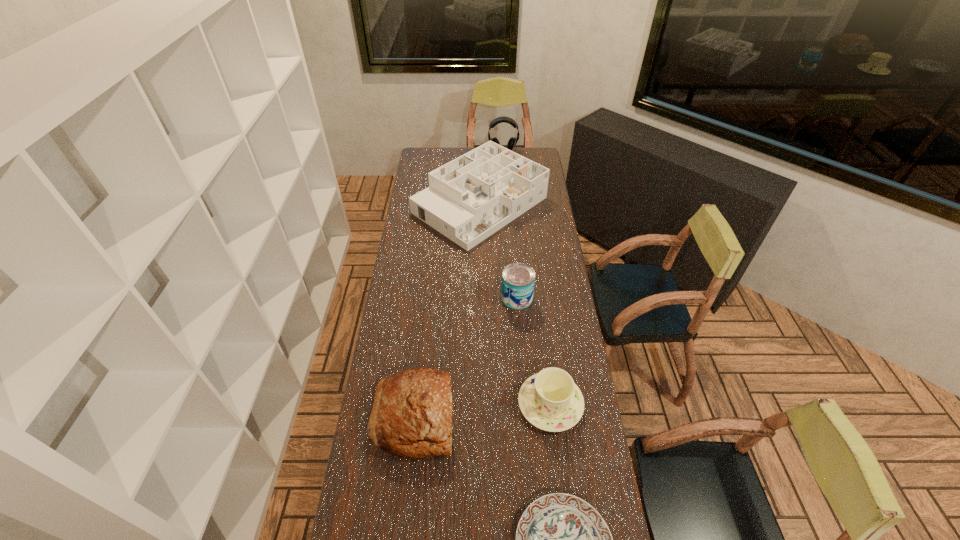
This screenshot has height=540, width=960. I want to click on object that stands as the fifth closest to the earphone, so click(x=561, y=539).

What are the coordinates of `free space that satisfies the following two spatial constraints: 1. on the front side of the can; 2. at the sliced front of the bread` in the screenshot? It's located at (526, 415).